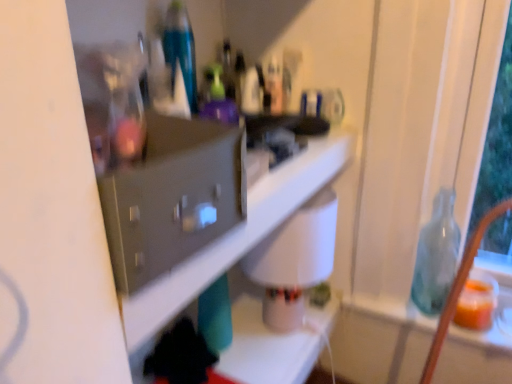
This screenshot has height=384, width=512. I want to click on white glossy shelf at center, so click(x=238, y=234).

What do you see at coordinates (238, 234) in the screenshot? I see `white glossy shelf at center` at bounding box center [238, 234].

In order to face white glossy shelf at center, should I rotate leftwards or rightwards?

It's best to rotate left around 1.313 degrees.

Where is `translucent glass bottle at right`? This screenshot has height=384, width=512. translucent glass bottle at right is located at coordinates (436, 256).

The height and width of the screenshot is (384, 512). What do you see at coordinates (436, 256) in the screenshot? I see `translucent glass bottle at right` at bounding box center [436, 256].

In order to click on white glossy shelf at center in this screenshot , I will do tap(238, 234).

Considering the positions of objects translucent glass bottle at right and white glossy shelf at center in the image provided, who is more to the right, translucent glass bottle at right or white glossy shelf at center?

translucent glass bottle at right.

Between translucent glass bottle at right and white glossy shelf at center, which one is positioned in front?

white glossy shelf at center is more forward.

Does point (435, 207) come closer to viewer compared to point (348, 136)?

No, it is not.

Based on the photo, from the image's perspective, is translucent glass bottle at right under white glossy shelf at center?

Correct, translucent glass bottle at right appears lower than white glossy shelf at center in the image.

From a real-world perspective, which is physically above, translucent glass bottle at right or white glossy shelf at center?

white glossy shelf at center, from a real-world perspective.

Is translucent glass bottle at right wider than white glossy shelf at center?

No.

Which of these two, translucent glass bottle at right or white glossy shelf at center, stands taller?

translucent glass bottle at right.

Based on their sizes in the image, would you say translucent glass bottle at right is bigger or smaller than white glossy shelf at center?

Considering their sizes, translucent glass bottle at right takes up less space than white glossy shelf at center.

Would you say translucent glass bottle at right is outside white glossy shelf at center?

Yes, translucent glass bottle at right is located beyond the bounds of white glossy shelf at center.

Is translucent glass bottle at right far away from white glossy shelf at center?

No.

Is translucent glass bottle at right turned away from white glossy shelf at center?

That's not correct — translucent glass bottle at right is not looking away from white glossy shelf at center.

Identify the location of bottle beneath the white glossy shelf at center (from a real-world perspective). (436, 256).

Would you say white glossy shelf at center is to the left or to the right of translucent glass bottle at right in the picture?

white glossy shelf at center is positioned on translucent glass bottle at right's left side.

In the scene shown: Between white glossy shelf at center and translucent glass bottle at right, which one is positioned in front?

white glossy shelf at center is more forward.

Is point (257, 237) farther from camera compared to point (436, 212)?

No, (257, 237) is in front of (436, 212).

From the image's perspective, relative to translucent glass bottle at right, is white glossy shelf at center above or below?

white glossy shelf at center is situated higher than translucent glass bottle at right in the image.

From a real-world perspective, which is physically above, white glossy shelf at center or translucent glass bottle at right?

From a 3D spatial view, white glossy shelf at center is above.

In terms of width, does white glossy shelf at center look wider or thinner when compared to translucent glass bottle at right?

white glossy shelf at center is wider than translucent glass bottle at right.

Considering the sizes of objects white glossy shelf at center and translucent glass bottle at right in the image provided, who is taller, white glossy shelf at center or translucent glass bottle at right?

translucent glass bottle at right is taller.

Consider the image. Who is smaller, white glossy shelf at center or translucent glass bottle at right?

Smaller between the two is translucent glass bottle at right.

From the picture: Can we say white glossy shelf at center lies outside translucent glass bottle at right?

white glossy shelf at center lies outside translucent glass bottle at right's area.

Is white glossy shelf at center far away from translucent glass bottle at right?

No, white glossy shelf at center is not far away from translucent glass bottle at right.

Is white glossy shelf at center facing towards translucent glass bottle at right?

No, white glossy shelf at center is not oriented towards translucent glass bottle at right.

What's the angular difference between white glossy shelf at center and translucent glass bottle at right's facing directions?

There is a 82.8-degree angle between the facing directions of white glossy shelf at center and translucent glass bottle at right.

Image resolution: width=512 pixels, height=384 pixels. Find the location of `bottle that appears below the white glossy shelf at center (from a real-world perspective)`. bottle that appears below the white glossy shelf at center (from a real-world perspective) is located at coordinates (436, 256).

Image resolution: width=512 pixels, height=384 pixels. In order to click on shelf located above the translucent glass bottle at right (from the image's perspective) in this screenshot , I will do `click(238, 234)`.

I want to click on bottle on the right of white glossy shelf at center, so click(436, 256).